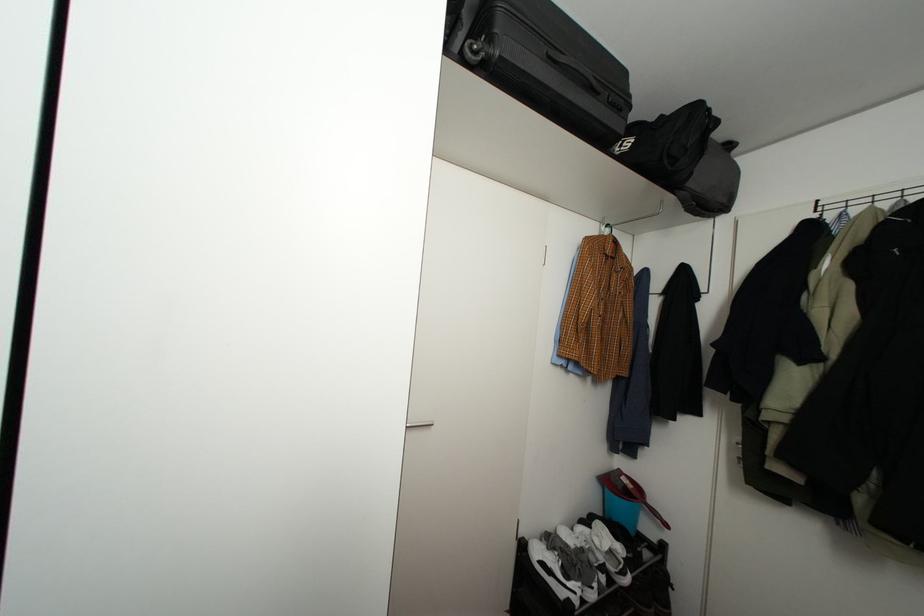
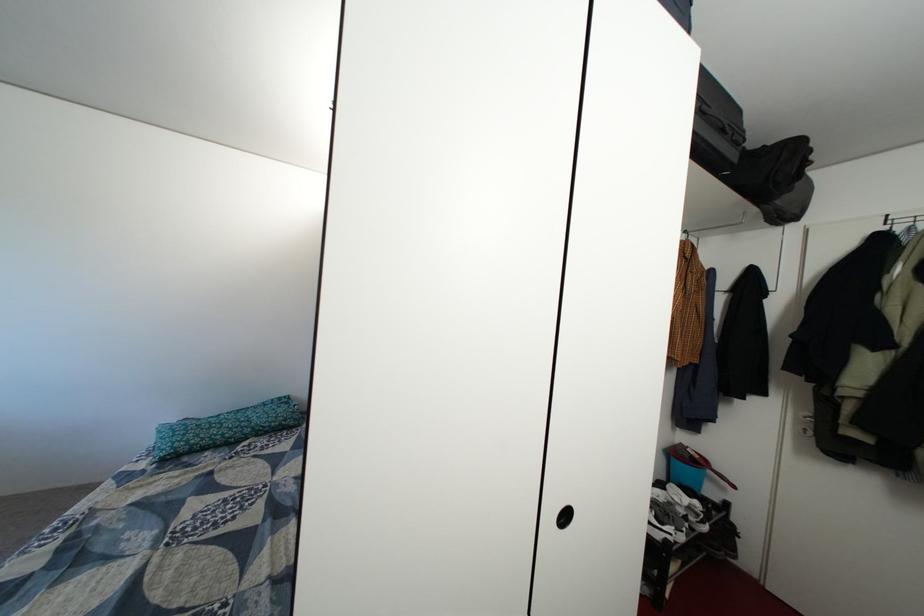
Find the pixel in the second image that matches (562,59) in the first image.

(715, 113)